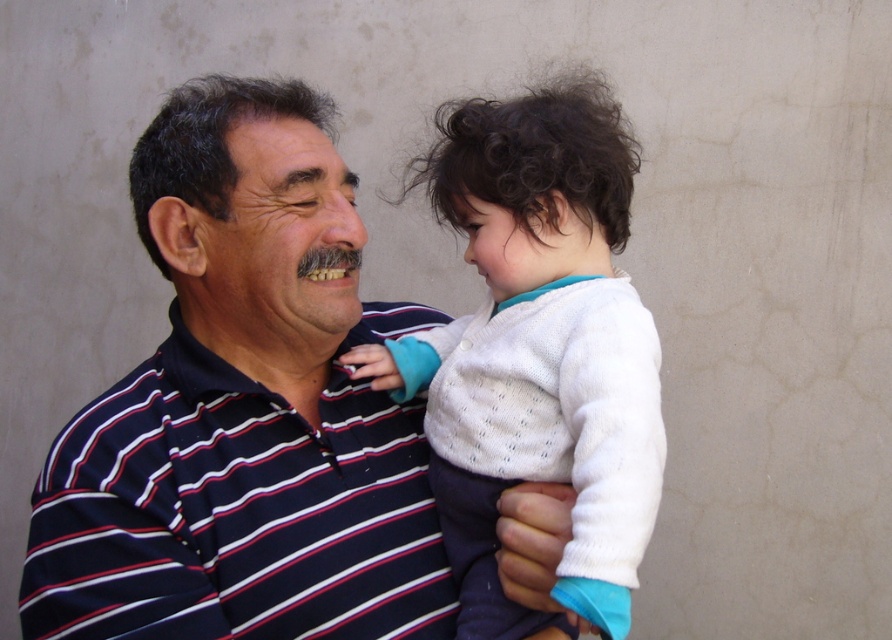
Question: Which point appears closest to the camera in this image?

Choices:
 (A) (541, 566)
 (B) (538, 240)

Answer: (A)

Question: Which point is farther to the camera?

Choices:
 (A) (616, 381)
 (B) (235, 369)

Answer: (B)

Question: Among these points, which one is nearest to the camera?

Choices:
 (A) (278, 179)
 (B) (449, 128)

Answer: (A)

Question: Is striped cotton shirt at center below white knit sweater at center?

Choices:
 (A) yes
 (B) no

Answer: (A)

Question: Does striped cotton shirt at center come in front of white knit sweater at center?

Choices:
 (A) yes
 (B) no

Answer: (B)

Question: Observing the image, what is the correct spatial positioning of striped cotton shirt at center in reference to white knit sweater at center?

Choices:
 (A) right
 (B) left

Answer: (B)